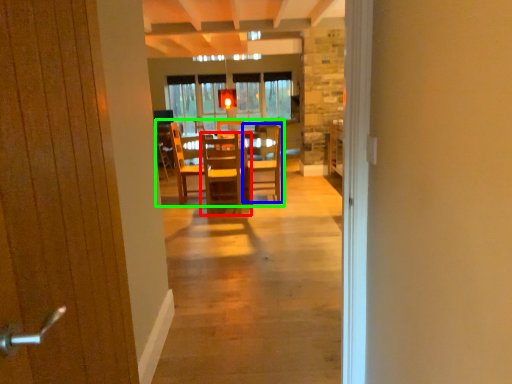
Question: Considering the real-world distances, which object is farthest from chair (highlighted by a red box)? chair (highlighted by a blue box) or kitchen & dining room table (highlighted by a green box)?

Choices:
 (A) chair
 (B) kitchen & dining room table

Answer: (A)